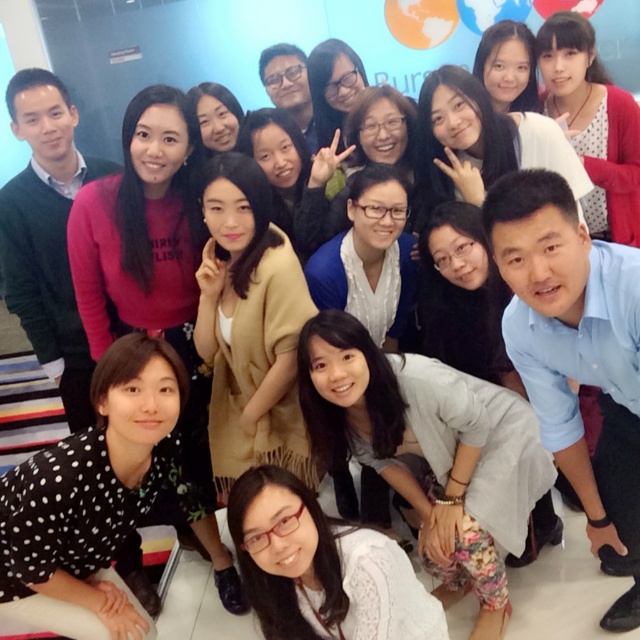
Question: Is blue shirt at lower right above sweater at left?

Choices:
 (A) no
 (B) yes

Answer: (A)

Question: Which point is closer to the camera?

Choices:
 (A) (356, 324)
 (B) (58, 259)

Answer: (A)

Question: Estimate the real-world distances between objects in this image. Which object is closer to the sweater at left?

Choices:
 (A) gray fabric shirt at lower center
 (B) matte red sweater at upper right
 (C) white lace blouse at lower center
 (D) blue shirt at lower right

Answer: (C)

Question: Which object is positioned closest to the white lace blouse at lower center?

Choices:
 (A) gray fabric shirt at lower center
 (B) blue shirt at lower right
 (C) matte red sweater at upper right

Answer: (A)

Question: Is sweater at left to the left of matte red sweater at upper right from the viewer's perspective?

Choices:
 (A) yes
 (B) no

Answer: (A)

Question: Is white lace blouse at lower center positioned in front of matte red sweater at upper right?

Choices:
 (A) no
 (B) yes

Answer: (B)